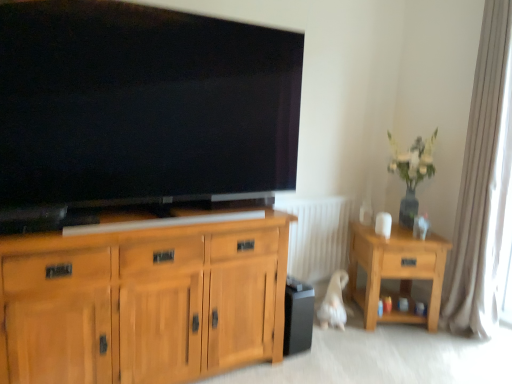
Find the location of `vacant point above white plastic radiator at center (from a real-world perspective)`. vacant point above white plastic radiator at center (from a real-world perspective) is located at coordinates (311, 196).